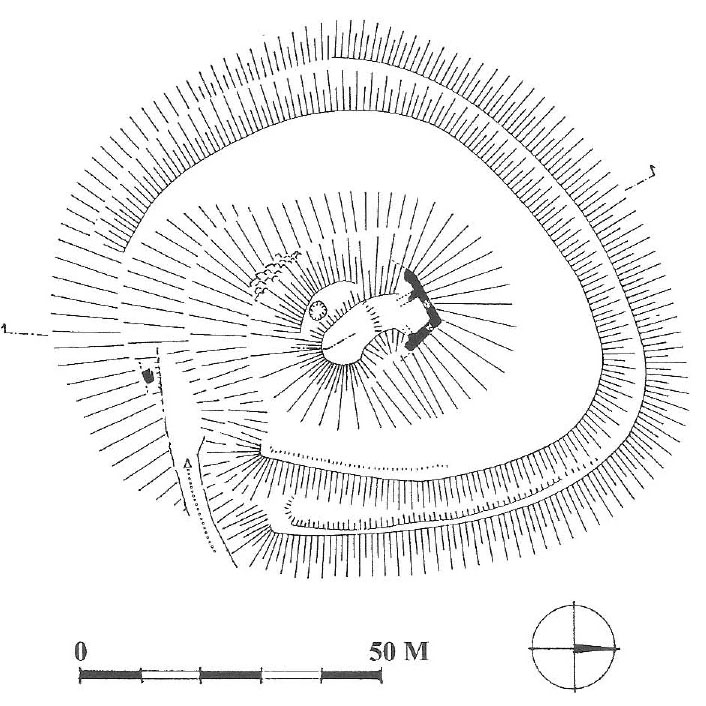
The width and height of the screenshot is (706, 706). In order to click on corner in this screenshot , I will do `click(433, 317)`.